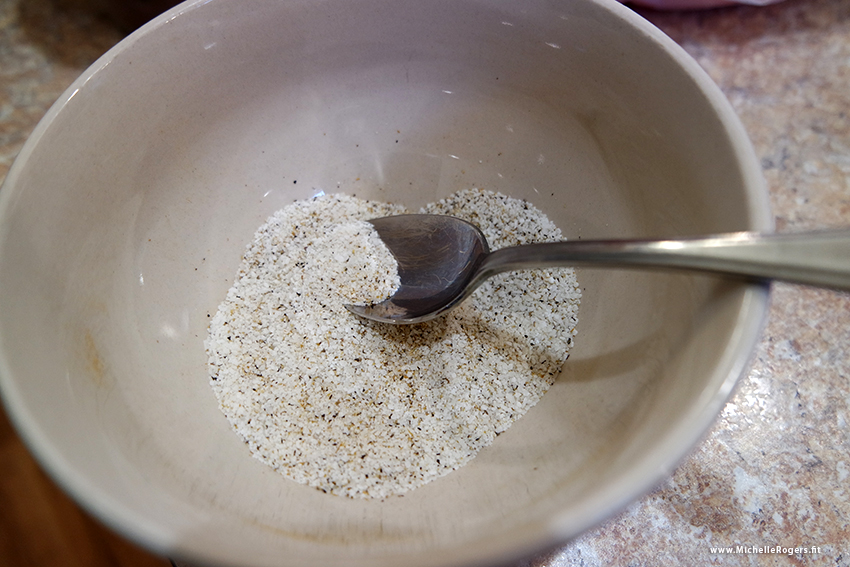
Find the location of a particular element. spoon is located at coordinates (460, 260).